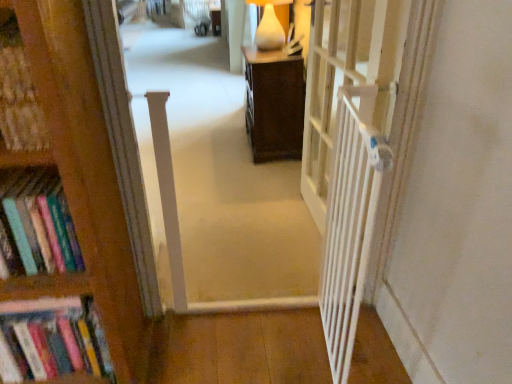
Question: From a real-world perspective, does white wooden gate at right stand above white plastic gate at right?

Choices:
 (A) yes
 (B) no

Answer: (B)

Question: Would you consider white wooden gate at right to be distant from white plastic gate at right?

Choices:
 (A) no
 (B) yes

Answer: (A)

Question: Is white wooden gate at right positioned in front of white plastic gate at right?

Choices:
 (A) no
 (B) yes

Answer: (B)

Question: From a real-world perspective, is white wooden gate at right physically below white plastic gate at right?

Choices:
 (A) no
 (B) yes

Answer: (B)

Question: From the image's perspective, is white wooden gate at right under white plastic gate at right?

Choices:
 (A) yes
 (B) no

Answer: (A)

Question: Considering the positions of white matte table lamp at upper center and hardcover books at left in the image, is white matte table lamp at upper center bigger or smaller than hardcover books at left?

Choices:
 (A) small
 (B) big

Answer: (A)

Question: From a real-world perspective, is white matte table lamp at upper center physically located above or below hardcover books at left?

Choices:
 (A) below
 (B) above

Answer: (B)

Question: Is point (265, 46) closer or farther from the camera than point (105, 380)?

Choices:
 (A) farther
 (B) closer

Answer: (A)

Question: In terms of height, does white matte table lamp at upper center look taller or shorter compared to hardcover books at left?

Choices:
 (A) tall
 (B) short

Answer: (B)

Question: From a real-world perspective, is hardcover books at left above or below white matte table lamp at upper center?

Choices:
 (A) above
 (B) below

Answer: (B)

Question: Considering the relative positions of hardcover books at left and white matte table lamp at upper center in the image provided, is hardcover books at left to the left or to the right of white matte table lamp at upper center?

Choices:
 (A) left
 (B) right

Answer: (A)

Question: In terms of size, does hardcover books at left appear bigger or smaller than white matte table lamp at upper center?

Choices:
 (A) big
 (B) small

Answer: (A)

Question: Is hardcover books at left spatially inside white matte table lamp at upper center, or outside of it?

Choices:
 (A) outside
 (B) inside

Answer: (A)

Question: From the image's perspective, is white matte table lamp at upper center positioned above or below white wooden gate at right?

Choices:
 (A) above
 (B) below

Answer: (A)

Question: From a real-world perspective, relative to white wooden gate at right, is white matte table lamp at upper center vertically above or below?

Choices:
 (A) above
 (B) below

Answer: (A)